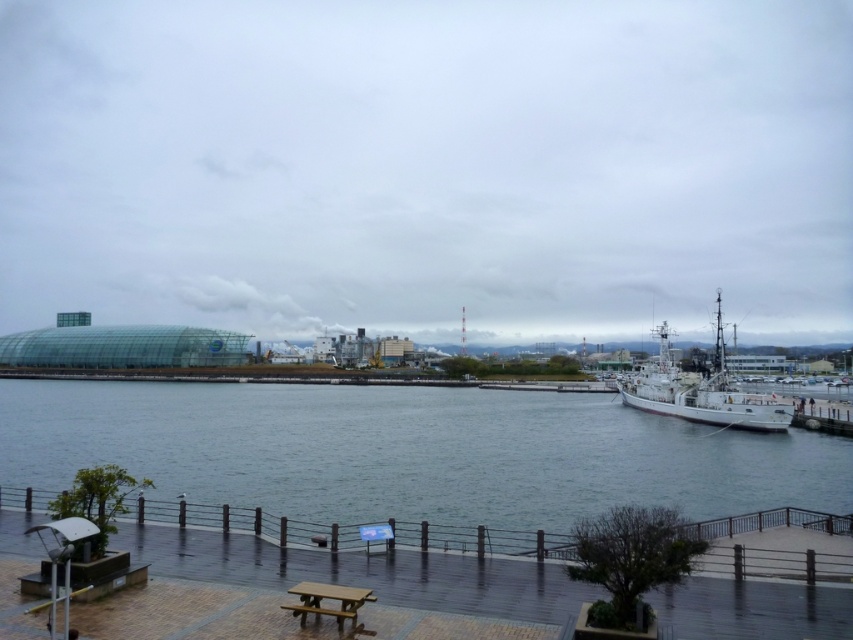
Between transparent glass dome at center and wooden picnic table at lower center, which one is positioned lower?

wooden picnic table at lower center is lower down.

Does point (21, 61) come closer to viewer compared to point (316, 612)?

No.

In order to click on transparent glass dome at center in this screenshot , I will do [x=428, y=166].

Is blue water at center further to camera compared to white matte boat at right?

That is False.

Is point (328, 424) positioned after point (741, 406)?

That is True.

Describe the element at coordinates (408, 451) in the screenshot. I see `blue water at center` at that location.

Identify the location of blue water at center. (408, 451).

Who is shorter, transparent glass dome at center or blue water at center?

blue water at center is shorter.

Is point (3, 8) farther from viewer compared to point (781, 467)?

Yes, point (3, 8) is behind point (781, 467).

I want to click on transparent glass dome at center, so click(428, 166).